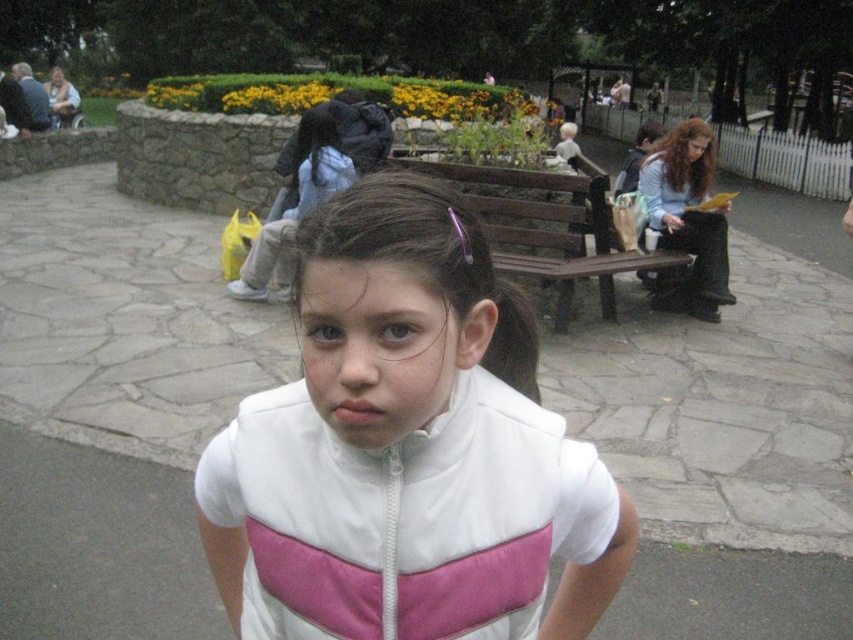
You are standing at the point labeled point (647, 252) and want to walk to the point labeled point (515, 490). Which direction should you move relative to the park pathway?

You should move forward along the park pathway because point (515, 490) is in front of point (647, 252).

You are standing at the entrance of the park and see the brown wooden bench at center and the brown hair at center. Which object is closer to you?

The brown wooden bench at center is closer to you because it is in front of the brown hair at center.

You are a photographer trying to capture a clear shot of the brown wooden bench at center and the brown hair at center. Since the bench is bigger, which object would you need to focus on more carefully to ensure it fits entirely within the frame?

The brown wooden bench at center is bigger than the brown hair at center, so you would need to focus more carefully on ensuring the brown wooden bench at center fits entirely within the frame.